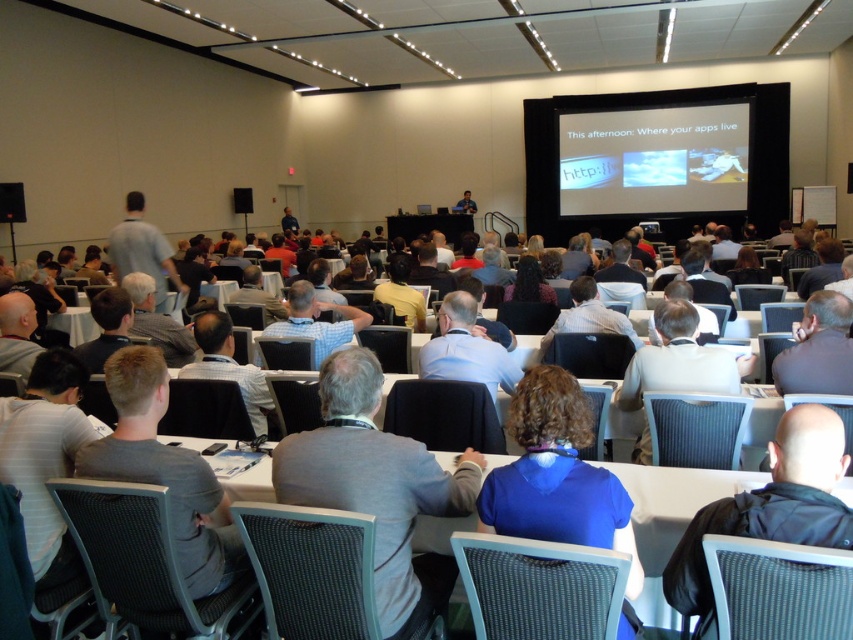
Is point (740, 154) positioned before point (566, 388)?

That is False.

Does matte black projector screen at upper center have a greater height compared to blue matte shirt at center?

Correct, matte black projector screen at upper center is much taller as blue matte shirt at center.

Locate an element on the screen. This screenshot has height=640, width=853. matte black projector screen at upper center is located at coordinates pyautogui.click(x=653, y=160).

Looking at this image, does gray fabric shirt at center appear under matte black projector screen at upper center?

Yes.

Looking at this image, does gray fabric shirt at center appear over matte black projector screen at upper center?

Incorrect, gray fabric shirt at center is not positioned above matte black projector screen at upper center.

This screenshot has width=853, height=640. Describe the element at coordinates (376, 486) in the screenshot. I see `gray fabric shirt at center` at that location.

Identify the location of gray fabric shirt at center. (376, 486).

Can you confirm if gray fabric shirt at center is shorter than blue matte shirt at center?

Incorrect, gray fabric shirt at center's height does not fall short of blue matte shirt at center's.

Is gray fabric shirt at center closer to camera compared to blue matte shirt at center?

No, it is not.

Describe the element at coordinates (376, 486) in the screenshot. I see `gray fabric shirt at center` at that location.

This screenshot has width=853, height=640. Identify the location of gray fabric shirt at center. (376, 486).